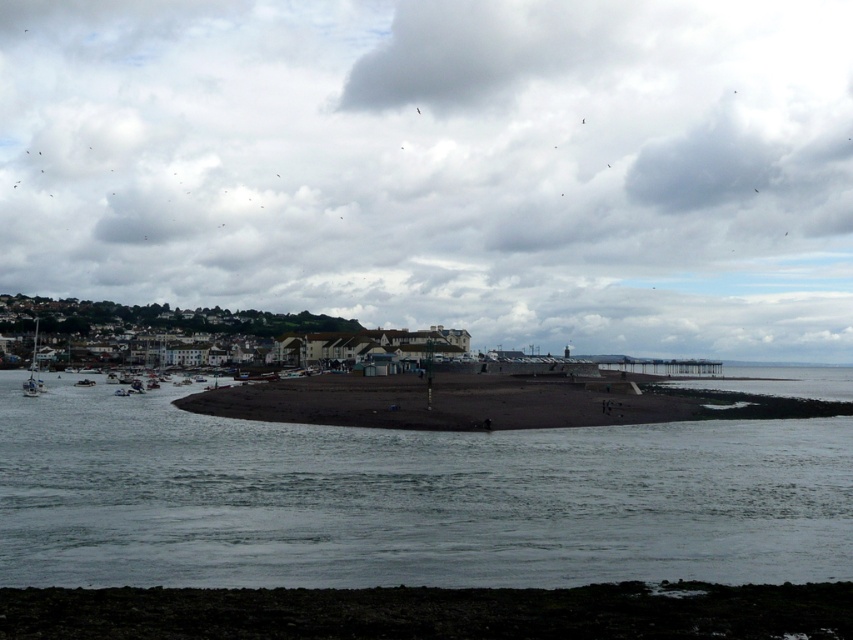
Question: Which of the following is the farthest from the observer?

Choices:
 (A) (38, 317)
 (B) (279, 596)
 (C) (346, 400)
 (D) (749, 195)

Answer: (D)

Question: Which object appears closest to the camera in this image?

Choices:
 (A) cloudy sky at upper center
 (B) white plastic sailboat at left

Answer: (B)

Question: Is dark gray water at center wider than dark sand at lower center?

Choices:
 (A) no
 (B) yes

Answer: (B)

Question: Which point is farther to the camera?

Choices:
 (A) (474, 573)
 (B) (622, 404)

Answer: (B)

Question: Can you confirm if dark gray water at center is smaller than white plastic sailboat at left?

Choices:
 (A) yes
 (B) no

Answer: (A)

Question: Does dark gray water at center have a smaller size compared to dark sand beach at center?

Choices:
 (A) yes
 (B) no

Answer: (B)